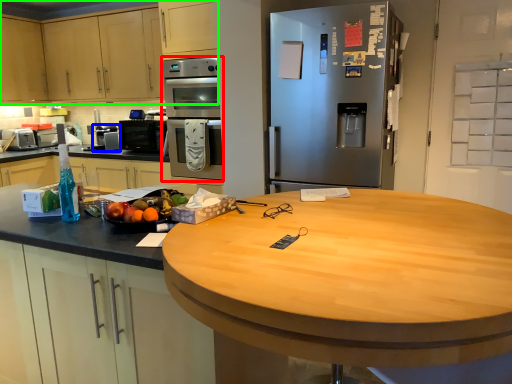
Question: Estimate the real-world distances between objects in this image. Which object is farther from oven (highlighted by a red box), appliance (highlighted by a blue box) or cabinetry (highlighted by a green box)?

Choices:
 (A) appliance
 (B) cabinetry

Answer: (A)